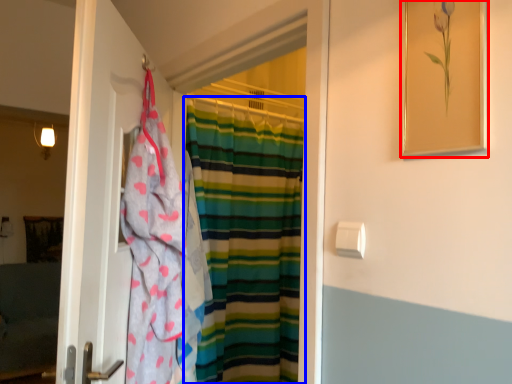
Question: Which object appears closest to the camera in this image, picture frame (highlighted by a red box) or curtain (highlighted by a blue box)?

Choices:
 (A) picture frame
 (B) curtain

Answer: (A)